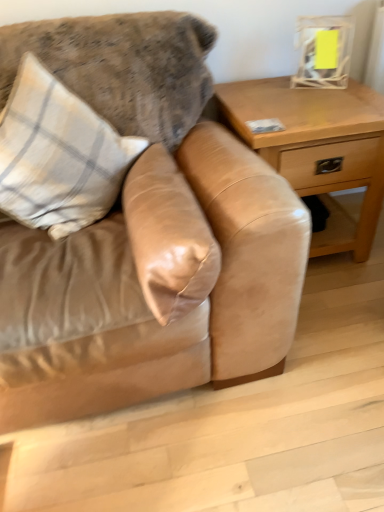
Question: From the image's perspective, is suede pillow at center, which is the 2th pillow from left to right, located above or below light brown wood table at right?

Choices:
 (A) below
 (B) above

Answer: (A)

Question: In the image, is suede pillow at center, which ranks as the 1th pillow in right-to-left order, positioned in front of or behind light brown wood table at right?

Choices:
 (A) front
 (B) behind

Answer: (A)

Question: Based on their relative distances, which object is nearer to the plaid fabric pillow at upper left, the first pillow viewed from the left?

Choices:
 (A) suede pillow at center, which is the 2th pillow from left to right
 (B) suede couch at center
 (C) light brown wood table at right

Answer: (B)

Question: Estimate the real-world distances between objects in this image. Which object is closer to the suede pillow at center, which ranks as the 1th pillow in right-to-left order?

Choices:
 (A) light brown wood table at right
 (B) plaid fabric pillow at upper left, positioned as the 2th pillow in right-to-left order
 (C) suede couch at center

Answer: (C)